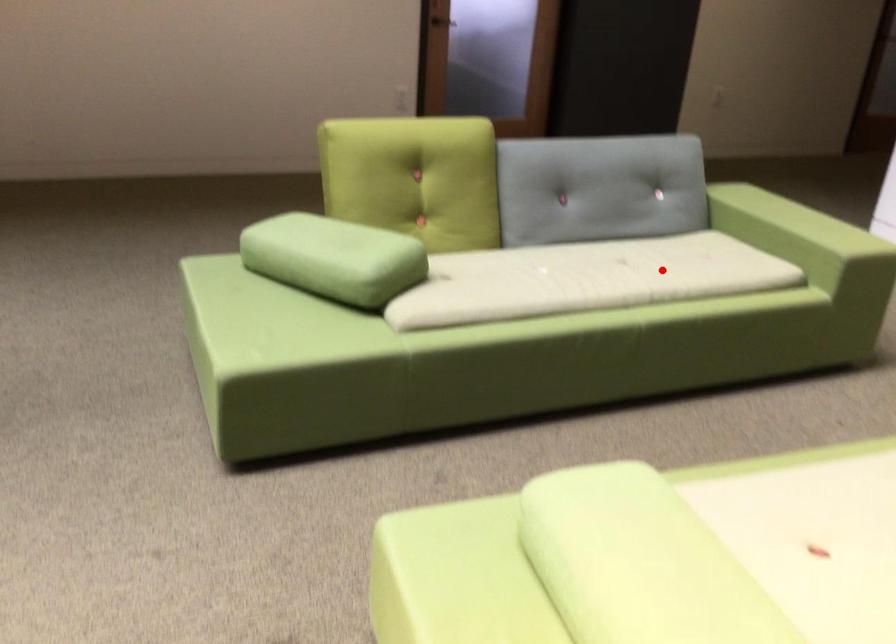
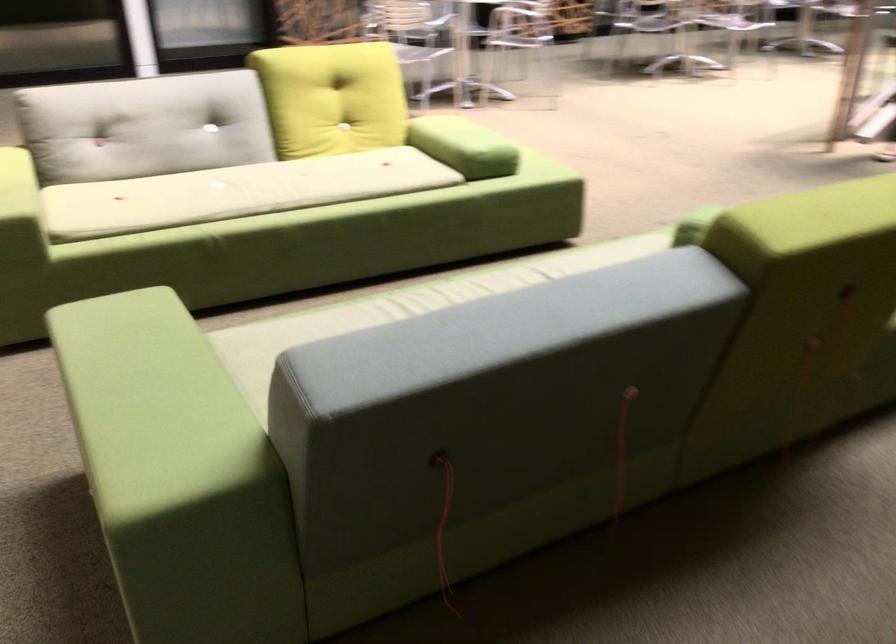
Where in the second image is the point corresponding to the highlighted location from the first image?

(401, 308)